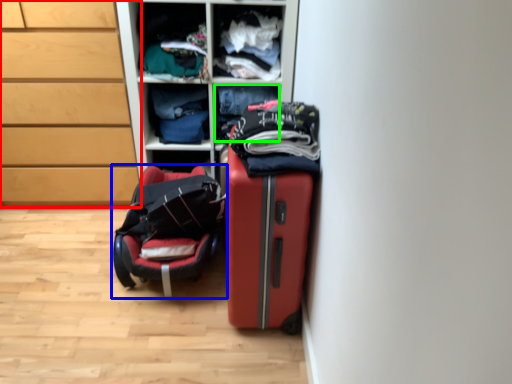
Question: Which object is the farthest from chest of drawers (highlighted by a red box)? Choose among these: luggage and bags (highlighted by a blue box) or clothing (highlighted by a green box).

Choices:
 (A) luggage and bags
 (B) clothing

Answer: (B)